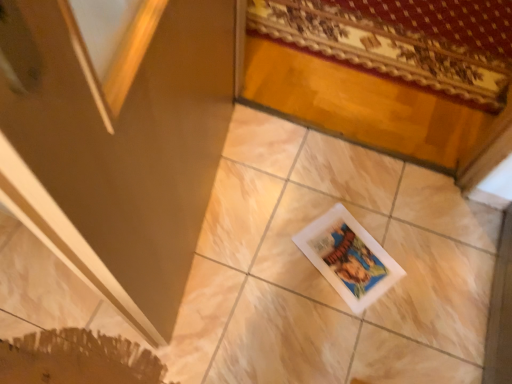
The width and height of the screenshot is (512, 384). What are the coordinates of `free spot in front of matte brown screen door at lower left` in the screenshot? It's located at (198, 330).